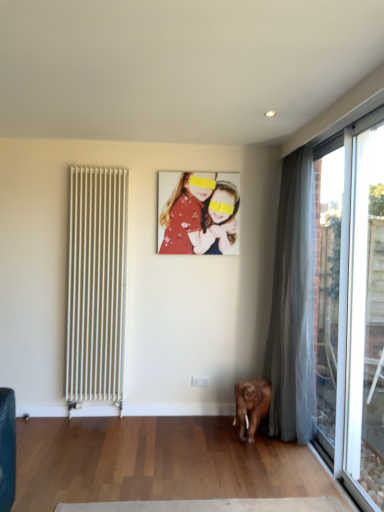
The width and height of the screenshot is (384, 512). What are the coordinates of `free spot in front of white metal radiator at left` in the screenshot? It's located at (83, 431).